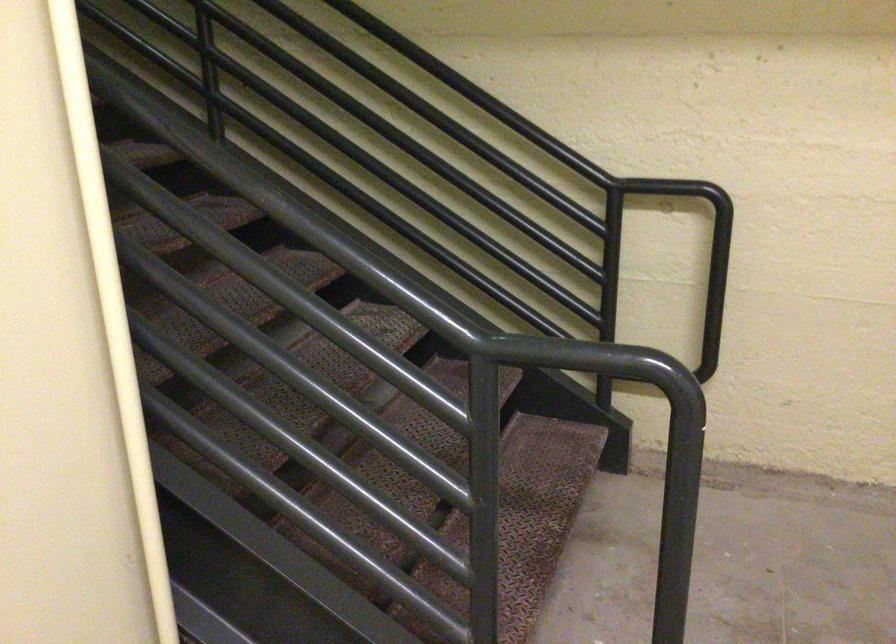
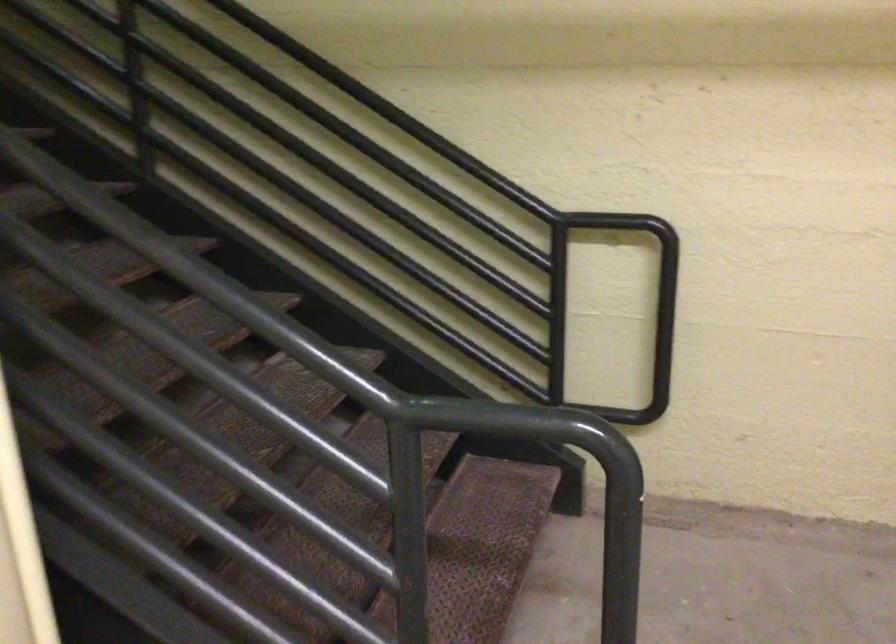
Which direction would the cameraman need to move to produce the second image?

The cameraman walked toward right, forward.